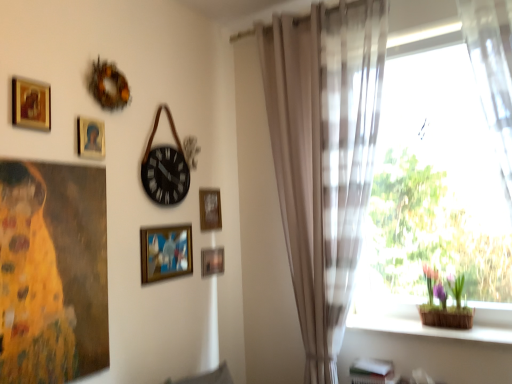
Question: In which direction should I rotate to look at wooden frame at center, acting as the 3th picture frame starting from the front?

Choices:
 (A) right
 (B) left

Answer: (B)

Question: Is wooden frame at center, the 3th picture frame positioned from the right, bigger than sheer beige curtain at right?

Choices:
 (A) no
 (B) yes

Answer: (A)

Question: Is wooden frame at center, the 2th picture frame positioned from the bottom, to the left of sheer beige curtain at right from the viewer's perspective?

Choices:
 (A) no
 (B) yes

Answer: (B)

Question: Is wooden frame at center, acting as the 3th picture frame starting from the front, closer to the viewer compared to sheer beige curtain at right?

Choices:
 (A) no
 (B) yes

Answer: (A)

Question: Is wooden frame at center, the 4th picture frame in the top-to-bottom sequence, turned away from sheer beige curtain at right?

Choices:
 (A) no
 (B) yes

Answer: (A)

Question: From a real-world perspective, is wooden frame at center, the 4th picture frame in the top-to-bottom sequence, located higher than sheer beige curtain at right?

Choices:
 (A) yes
 (B) no

Answer: (B)

Question: Would you say sheer beige curtain at right is part of wooden frame at center, acting as the 3th picture frame starting from the front,'s contents?

Choices:
 (A) no
 (B) yes

Answer: (A)

Question: From a real-world perspective, is green leafy plant at right on top of wooden frame at center, arranged as the 3th picture frame when viewed from the left?

Choices:
 (A) no
 (B) yes

Answer: (A)

Question: Could you tell me if green leafy plant at right is turned towards wooden frame at center, the 2th picture frame positioned from the bottom?

Choices:
 (A) no
 (B) yes

Answer: (A)

Question: Is green leafy plant at right facing away from wooden frame at center, acting as the 3th picture frame starting from the front?

Choices:
 (A) no
 (B) yes

Answer: (A)

Question: Does green leafy plant at right appear on the right side of wooden frame at center, which ranks as the 3th picture frame in back-to-front order?

Choices:
 (A) no
 (B) yes

Answer: (B)

Question: From the image's perspective, does green leafy plant at right appear higher than wooden frame at center, arranged as the 3th picture frame when viewed from the left?

Choices:
 (A) no
 (B) yes

Answer: (A)

Question: Is green leafy plant at right positioned far away from wooden frame at center, the 3th picture frame positioned from the right?

Choices:
 (A) no
 (B) yes

Answer: (B)

Question: Does metallic gold picture frame at lower center, which is the 1th picture frame in right-to-left order, have a greater height compared to wooden frame at center, the 4th picture frame in the top-to-bottom sequence?

Choices:
 (A) yes
 (B) no

Answer: (B)